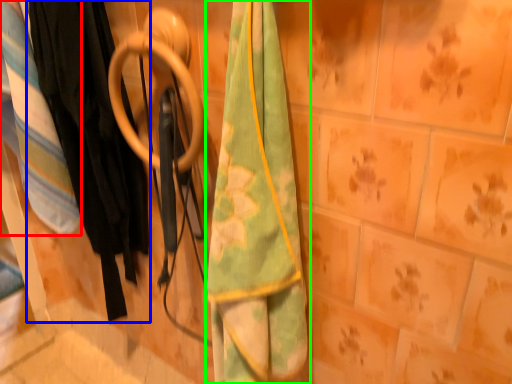
Question: Which object is the closest to the blanket (highlighted by a red box)? Choose among these: clothing (highlighted by a blue box) or towel (highlighted by a green box).

Choices:
 (A) clothing
 (B) towel

Answer: (A)